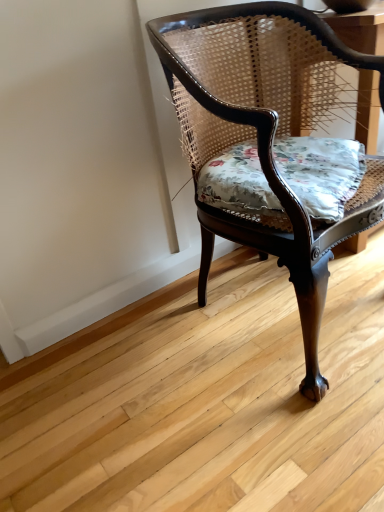
Locate an element on the screen. free location to the left of mahogany cane chair at center is located at coordinates (119, 374).